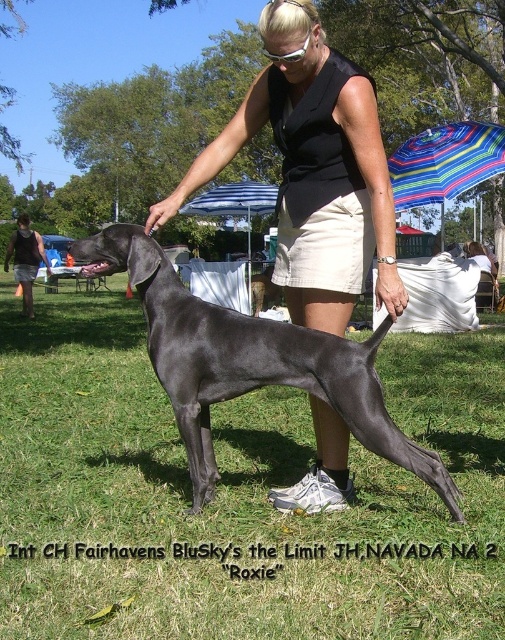
Consider the image. You are a photographer at the dog show and want to take a picture of the shiny black dog at center. Since the green grass at center is under the dog, will the grass be visible in the photo?

The green grass at center is positioned under shiny black dog at center, so the grass will be visible underneath the dog in the photo.

You are a photographer at the dog show and want to capture a closeup of the black matte skirt at center. Where exactly should you focus your camera?

You should focus your camera at point 0.267 on the x axis and 0.622 on the y axis to capture the black matte skirt at center.